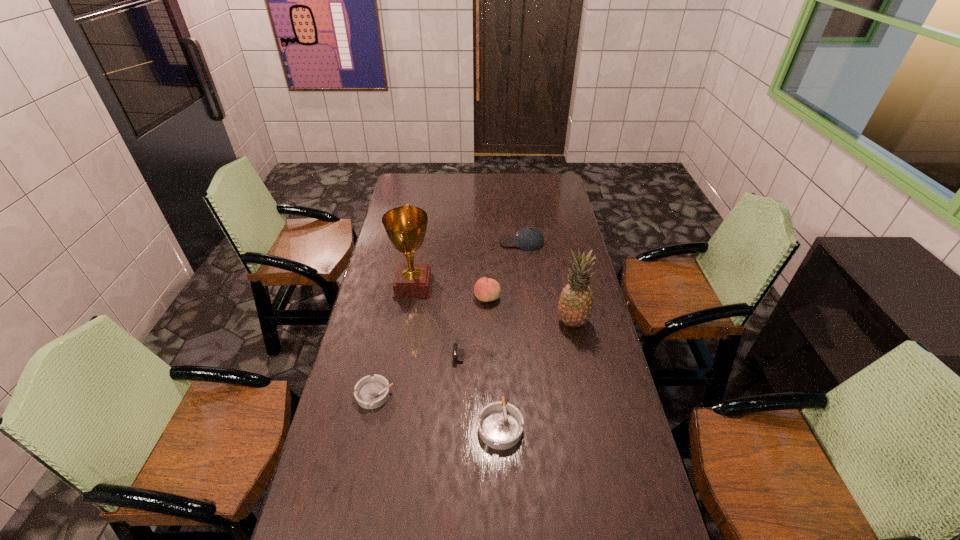
Image resolution: width=960 pixels, height=540 pixels. Identify the location of empty space that is in between the pineapple and the webcam. (526, 339).

Image resolution: width=960 pixels, height=540 pixels. I want to click on unoccupied position between the shorter ashtray and the pineapple, so click(x=473, y=358).

Locate an element on the screen. This screenshot has width=960, height=540. unoccupied position between the pineapple and the fifth farthest object is located at coordinates (526, 339).

You are a GUI agent. You are given a task and a screenshot of the screen. Output one action in this format:
    pyautogui.click(x=<x>, y=<y>)
    Task: Click on the free spot between the shorter ashtray and the pineapple
    
    Given the screenshot: What is the action you would take?
    coord(473,358)

Where is `free spot between the fourth tallest object and the webcam`? free spot between the fourth tallest object and the webcam is located at coordinates (501, 299).

You are a GUI agent. You are given a task and a screenshot of the screen. Output one action in this format:
    pyautogui.click(x=<x>, y=<y>)
    Task: Click on the vacant area that lies between the fourth tallest object and the left ashtray
    This screenshot has width=960, height=540.
    Given the screenshot: What is the action you would take?
    pyautogui.click(x=448, y=318)

At what (x,y) coordinates should I click in order to perform the action: click on unoccupied position between the award and the webcam. Please return your answer as a coordinate pair (x, y). The width and height of the screenshot is (960, 540). Looking at the image, I should click on (446, 321).

Locate an element on the screen. This screenshot has height=540, width=960. object that stands as the third closest to the pineapple is located at coordinates (500, 426).

Point out which object is positioned as the fifth nearest to the left ashtray. Please provide its 2D coordinates. Your answer should be formatted as a tuple, i.e. [(x, y)], where the tuple contains the x and y coordinates of a point satisfying the conditions above.

[(575, 306)]

You are a GUI agent. You are given a task and a screenshot of the screen. Output one action in this format:
    pyautogui.click(x=<x>, y=<y>)
    Task: Click on the vacant region that satisfies the following two spatial constraints: 1. on the front-facing side of the taller ashtray; 2. on the left side of the webcam
    
    Given the screenshot: What is the action you would take?
    pyautogui.click(x=480, y=426)